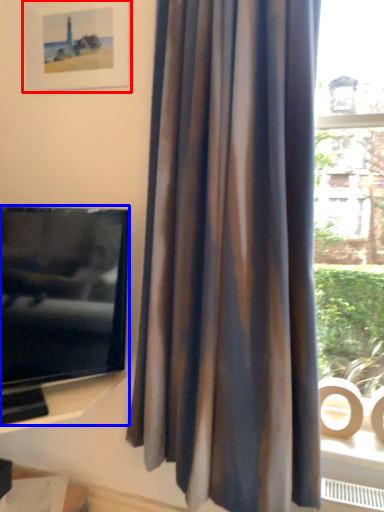
Question: Which object is further to the camera taking this photo, picture frame (highlighted by a red box) or television (highlighted by a blue box)?

Choices:
 (A) picture frame
 (B) television

Answer: (A)